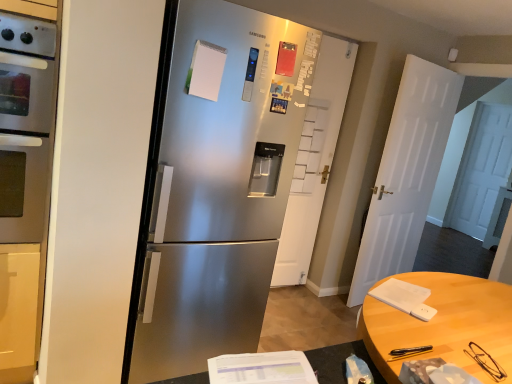
The width and height of the screenshot is (512, 384). I want to click on white matte door at center, the 2th door in the right-to-left sequence, so click(314, 160).

Image resolution: width=512 pixels, height=384 pixels. Describe the element at coordinates (406, 173) in the screenshot. I see `white matte door at center, arranged as the second door when viewed from the left` at that location.

Where is `satin silver refrigerator at center`? satin silver refrigerator at center is located at coordinates (218, 185).

This screenshot has height=384, width=512. Find the location of `white matte door at center, the 1th door positioned from the left`. white matte door at center, the 1th door positioned from the left is located at coordinates (314, 160).

Looking at this image, is satin silver oven at left outside of white matte door at center, arranged as the second door when viewed from the left?

Yes.

From the image's perspective, starting from the satin silver oven at left, which door is the 2nd one below? Please provide its 2D coordinates.

[(406, 173)]

Is light brown wooden table at lower right turned away from white matte door at center, which is counted as the first door, starting from the right?

light brown wooden table at lower right does not have its back to white matte door at center, which is counted as the first door, starting from the right.

Is point (466, 325) positioned behind point (450, 103)?

No, it is in front of (450, 103).

Considering the relative positions of light brown wooden table at lower right and white matte door at center, which is counted as the first door, starting from the right, in the image provided, is light brown wooden table at lower right to the left or to the right of white matte door at center, which is counted as the first door, starting from the right,?

Based on their positions, light brown wooden table at lower right is located to the left of white matte door at center, which is counted as the first door, starting from the right.

From the image's perspective, is light brown wooden table at lower right on top of white matte door at center, arranged as the second door when viewed from the left?

No, from the image's perspective, light brown wooden table at lower right is not over white matte door at center, arranged as the second door when viewed from the left.

Considering their positions, is satin silver refrigerator at center located in front of or behind light brown wooden table at lower right?

In the image, satin silver refrigerator at center appears behind light brown wooden table at lower right.

How different are the orientations of satin silver refrigerator at center and light brown wooden table at lower right in degrees?

There is a 91.4-degree angle between the facing directions of satin silver refrigerator at center and light brown wooden table at lower right.

Which is closer to the camera, (246, 229) or (509, 324)?

Positioned in front is point (509, 324).

Is satin silver refrigerator at center inside or outside of light brown wooden table at lower right?

satin silver refrigerator at center exists outside the volume of light brown wooden table at lower right.

Looking at the image, does satin silver oven at left seem bigger or smaller compared to white matte door at center, the 2th door in the right-to-left sequence?

Clearly, satin silver oven at left is larger in size than white matte door at center, the 2th door in the right-to-left sequence.

Is point (2, 219) positioned before point (340, 61)?

Yes, point (2, 219) is in front of point (340, 61).

Looking at this image, is satin silver oven at left not inside white matte door at center, the 1th door positioned from the left?

Yes.

Which door is the 2nd one when counting from the back of the satin silver refrigerator at center? Please provide its 2D coordinates.

[(314, 160)]

From the picture: Can you confirm if white matte door at center, the 2th door in the right-to-left sequence, is taller than satin silver refrigerator at center?

Indeed, white matte door at center, the 2th door in the right-to-left sequence, has a greater height compared to satin silver refrigerator at center.

Consider the image. Considering the sizes of objects white matte door at center, the 2th door in the right-to-left sequence, and satin silver refrigerator at center in the image provided, who is bigger, white matte door at center, the 2th door in the right-to-left sequence, or satin silver refrigerator at center?

Bigger between the two is satin silver refrigerator at center.

Can you tell me how much white matte door at center, the 2th door in the right-to-left sequence, and satin silver refrigerator at center differ in facing direction?

The angle between the facing direction of white matte door at center, the 2th door in the right-to-left sequence, and the facing direction of satin silver refrigerator at center is 4.24 degrees.

Does white matte door at center, arranged as the second door when viewed from the left, turn towards satin silver refrigerator at center?

No.

From the image's perspective, is white matte door at center, arranged as the second door when viewed from the left, positioned above or below satin silver refrigerator at center?

white matte door at center, arranged as the second door when viewed from the left, is situated higher than satin silver refrigerator at center in the image.

Does point (372, 218) come farther from viewer compared to point (231, 234)?

Yes, point (372, 218) is behind point (231, 234).

Looking at this image, is white matte door at center, which is counted as the first door, starting from the right, to the right of satin silver refrigerator at center from the viewer's perspective?

Yes, white matte door at center, which is counted as the first door, starting from the right, is to the right of satin silver refrigerator at center.

Is light brown wooden table at lower right to the left of satin silver refrigerator at center from the viewer's perspective?

No, light brown wooden table at lower right is not to the left of satin silver refrigerator at center.

Is light brown wooden table at lower right not close to satin silver refrigerator at center?

No, there isn't a large distance between light brown wooden table at lower right and satin silver refrigerator at center.

Does light brown wooden table at lower right have a greater width compared to satin silver refrigerator at center?

Yes.

At what (x,y) coordinates should I click in order to perform the action: click on door that is the 1st one when counting backward from the satin silver oven at left. Please return your answer as a coordinate pair (x, y). Image resolution: width=512 pixels, height=384 pixels. Looking at the image, I should click on (406, 173).

The width and height of the screenshot is (512, 384). In order to click on table in front of the white matte door at center, arranged as the second door when viewed from the left in this screenshot , I will do `click(442, 324)`.

Consider the image. Based on their spatial positions, is white matte door at center, the 2th door in the right-to-left sequence, or satin silver oven at left closer to light brown wooden table at lower right?

Based on the image, satin silver oven at left appears to be nearer to light brown wooden table at lower right.

Based on their spatial positions, is satin silver refrigerator at center or satin silver oven at left further from white matte door at center, the 1th door positioned from the left?

satin silver oven at left is positioned further to the anchor white matte door at center, the 1th door positioned from the left.

Which object lies nearer to the anchor point satin silver oven at left, white matte door at center, which is counted as the first door, starting from the right, or white matte door at center, the 1th door positioned from the left?

The object closer to satin silver oven at left is white matte door at center, the 1th door positioned from the left.

Based on the photo, when comparing their distances from satin silver oven at left, does satin silver refrigerator at center or light brown wooden table at lower right seem further?

Based on the image, light brown wooden table at lower right appears to be further to satin silver oven at left.

When comparing their distances from white matte door at center, which is counted as the first door, starting from the right, does satin silver oven at left or satin silver refrigerator at center seem closer?

The object closer to white matte door at center, which is counted as the first door, starting from the right, is satin silver refrigerator at center.

When comparing their distances from white matte door at center, the 1th door positioned from the left, does light brown wooden table at lower right or satin silver oven at left seem closer?

light brown wooden table at lower right lies closer to white matte door at center, the 1th door positioned from the left, than the other object.

Estimate the real-world distances between objects in this image. Which object is closer to satin silver refrigerator at center, satin silver oven at left or white matte door at center, the 2th door in the right-to-left sequence?

Among the two, satin silver oven at left is located nearer to satin silver refrigerator at center.

From the image, which object appears to be nearer to satin silver refrigerator at center, light brown wooden table at lower right or satin silver oven at left?

satin silver oven at left.

The image size is (512, 384). What are the coordinates of `door between satin silver oven at left and white matte door at center, arranged as the second door when viewed from the left` in the screenshot? It's located at pyautogui.click(x=314, y=160).

Identify the location of refrigerator between light brown wooden table at lower right and white matte door at center, the 2th door in the right-to-left sequence, from front to back. This screenshot has width=512, height=384. (218, 185).

Where is `door positioned between satin silver refrigerator at center and white matte door at center, the 1th door positioned from the left, from near to far`? This screenshot has width=512, height=384. door positioned between satin silver refrigerator at center and white matte door at center, the 1th door positioned from the left, from near to far is located at coordinates (406, 173).

This screenshot has width=512, height=384. Identify the location of refrigerator between satin silver oven at left and white matte door at center, which is counted as the first door, starting from the right, from left to right. (218, 185).